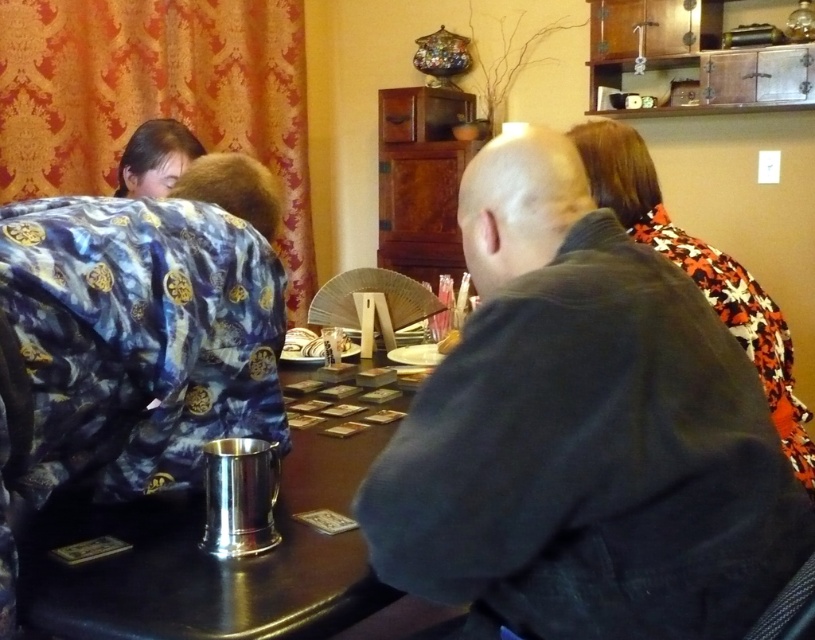
Does blue satin robe at left appear under shiny silver cup at center?

Incorrect, blue satin robe at left is not positioned below shiny silver cup at center.

Can you confirm if blue satin robe at left is taller than shiny silver cup at center?

Yes.

Between point (117, 291) and point (47, 630), which one is positioned behind?

The point (117, 291) is more distant.

This screenshot has width=815, height=640. I want to click on blue satin robe at left, so click(x=133, y=344).

Is point (620, 340) in front of point (377, 588)?

Yes, point (620, 340) is in front of point (377, 588).

Which is in front, point (542, 308) or point (234, 608)?

Point (542, 308) is more forward.

Find the location of a particular element. The width and height of the screenshot is (815, 640). dark gray jacket at center is located at coordinates (584, 433).

Who is shorter, blue satin robe at left or floral-patterned fabric at upper right?

blue satin robe at left

This screenshot has width=815, height=640. Identify the location of blue satin robe at left. (133, 344).

The height and width of the screenshot is (640, 815). Identify the location of blue satin robe at left. 133,344.